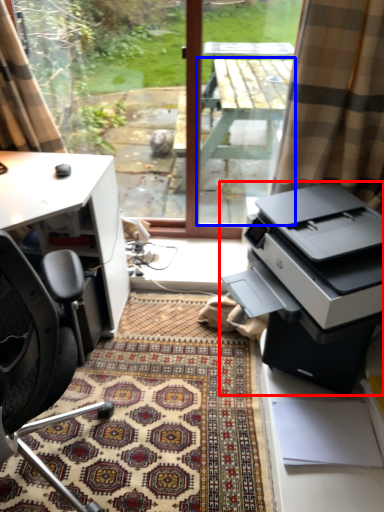
Question: Which of the following is the closest to the observer, printer (highlighted by a red box) or table (highlighted by a blue box)?

Choices:
 (A) printer
 (B) table

Answer: (A)